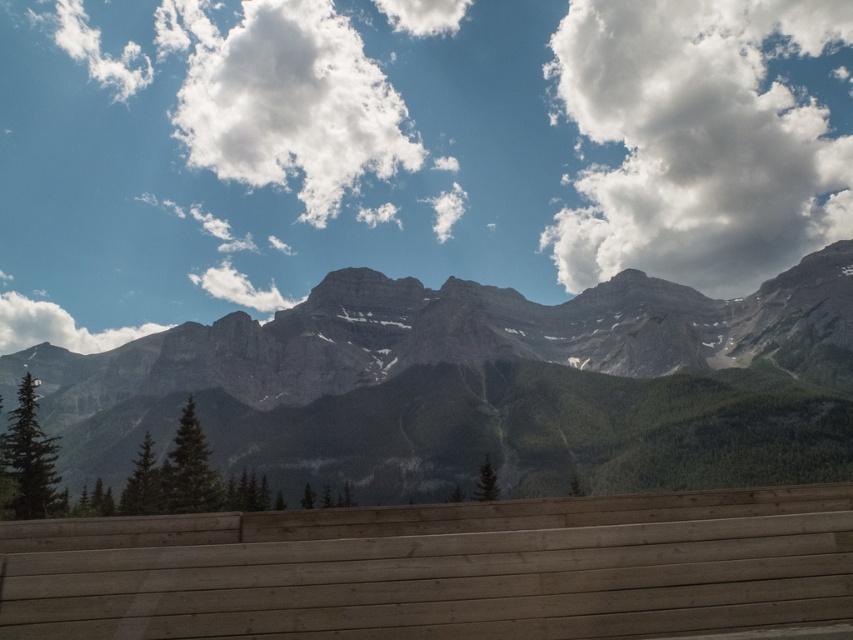
Who is taller, gray rock mountain range at center or white fluffy cloud at upper center?

white fluffy cloud at upper center

Which is behind, point (792, 464) or point (386, 129)?

Positioned behind is point (386, 129).

You are a GUI agent. You are given a task and a screenshot of the screen. Output one action in this format:
    pyautogui.click(x=<x>, y=<y>)
    Task: Click on the gray rock mountain range at center
    The width and height of the screenshot is (853, 640).
    Given the screenshot: What is the action you would take?
    pyautogui.click(x=480, y=385)

Where is `gray rock mountain range at center`? gray rock mountain range at center is located at coordinates (480, 385).

This screenshot has width=853, height=640. Describe the element at coordinates (440, 570) in the screenshot. I see `natural wood park bench at lower center` at that location.

From the picture: Is natural wood park bench at lower center taller than white fluffy cloud at upper right?

Incorrect, natural wood park bench at lower center's height is not larger of white fluffy cloud at upper right's.

Measure the distance between point (51, 531) and camera.

Point (51, 531) and camera are 134.86 meters apart.

Where is `natural wood park bench at lower center`? The height and width of the screenshot is (640, 853). natural wood park bench at lower center is located at coordinates (440, 570).

Who is higher up, natural wood park bench at lower center or white fluffy cloud at upper left?

white fluffy cloud at upper left is above.

What do you see at coordinates (440, 570) in the screenshot? I see `natural wood park bench at lower center` at bounding box center [440, 570].

This screenshot has width=853, height=640. I want to click on natural wood park bench at lower center, so click(440, 570).